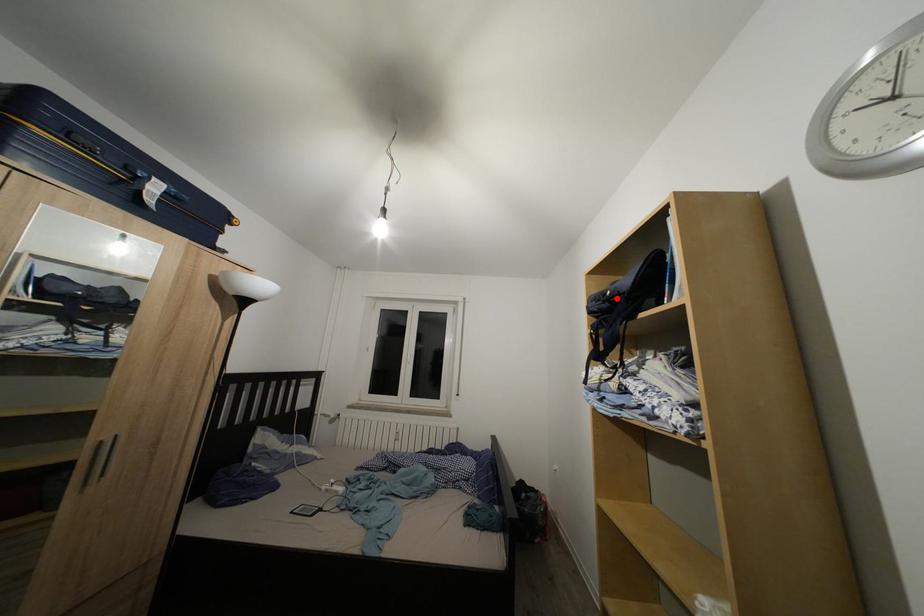
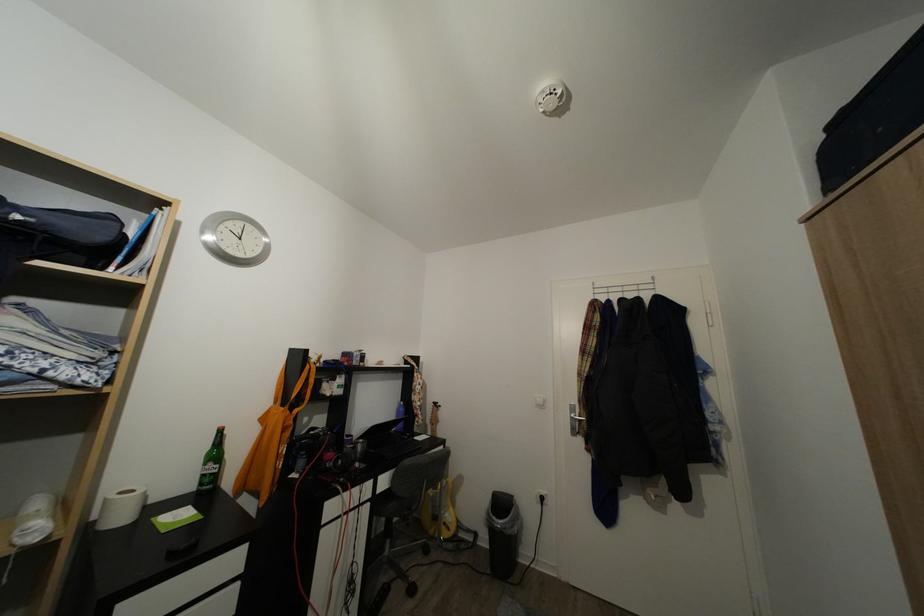
Where in the second image is the point corresponding to the highlighted location from the first image?

(25, 223)